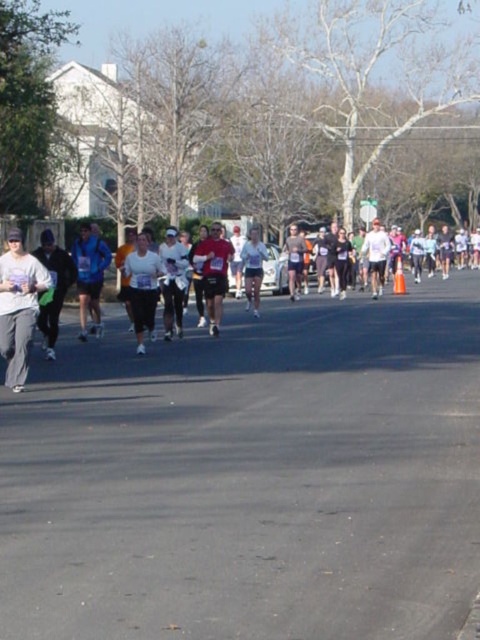
Question: Estimate the real-world distances between objects in this image. Which object is farther from the white matte shirt at center?

Choices:
 (A) matte red shirt at center
 (B) gray matte pants at left

Answer: (B)

Question: Which point is closer to the camera taking this photo?

Choices:
 (A) (214, 273)
 (B) (143, 321)

Answer: (B)

Question: Is white matte shirt at center thinner than matte red shirt at center?

Choices:
 (A) no
 (B) yes

Answer: (B)

Question: Is gray matte pants at left below matte red shirt at center?

Choices:
 (A) no
 (B) yes

Answer: (B)

Question: Where is white matte shirt at center located in relation to matte red shirt at center in the image?

Choices:
 (A) left
 (B) right

Answer: (A)

Question: Based on their relative distances, which object is farther from the white matte shirt at center?

Choices:
 (A) matte red shirt at center
 (B) gray matte pants at left

Answer: (B)